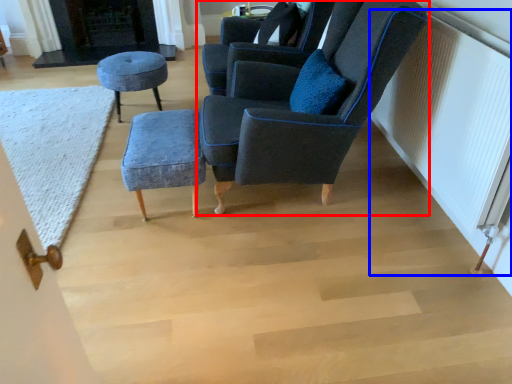
Question: Which object is closer to the camera taking this photo, chair (highlighted by a red box) or radiator (highlighted by a blue box)?

Choices:
 (A) chair
 (B) radiator

Answer: (B)